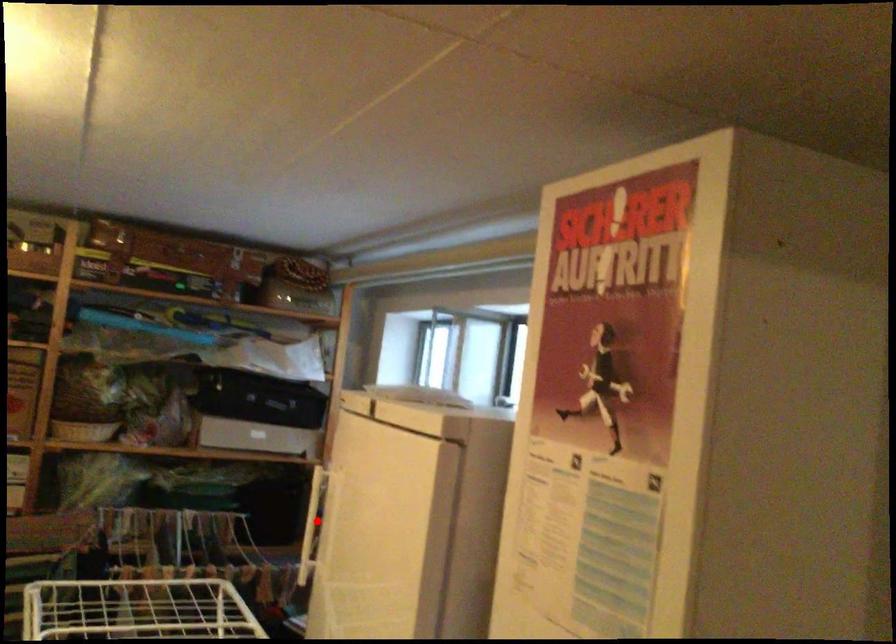
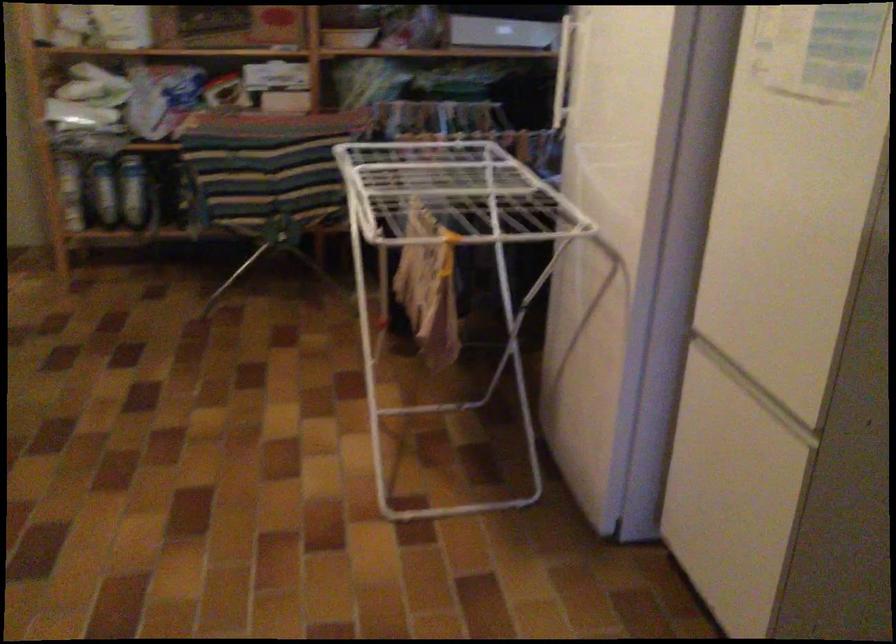
Question: I am providing you with two images of the same scene from different viewpoints. Given a red point in image1, look at the same physical point in image2. Is it:

Choices:
 (A) Closer to the viewpoint
 (B) Farther from the viewpoint

Answer: (B)